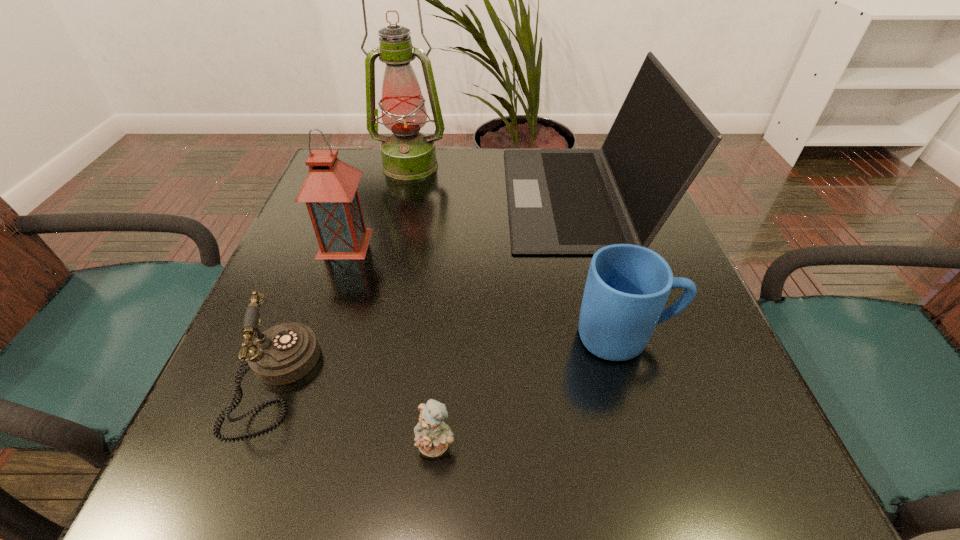
Where is `mug that is at the right edge`? mug that is at the right edge is located at coordinates (627, 286).

I want to click on object located at the far left corner, so click(407, 154).

What are the coordinates of `object situated at the near left corner` in the screenshot? It's located at (285, 353).

Where is `object located at the far right corner`? object located at the far right corner is located at coordinates (560, 201).

The width and height of the screenshot is (960, 540). I want to click on vacant space at the far edge, so click(x=412, y=193).

The image size is (960, 540). Identify the location of free space at the near edge. (356, 491).

Where is `vacant region at the left edge`? The width and height of the screenshot is (960, 540). vacant region at the left edge is located at coordinates (273, 312).

The width and height of the screenshot is (960, 540). In the image, there is a desktop. Identify the location of vacant space at the right edge. click(x=753, y=402).

Where is `blank area at the far left corner`? The width and height of the screenshot is (960, 540). blank area at the far left corner is located at coordinates (382, 174).

The image size is (960, 540). I want to click on free space that is in between the telephone and the teddy bear, so click(355, 413).